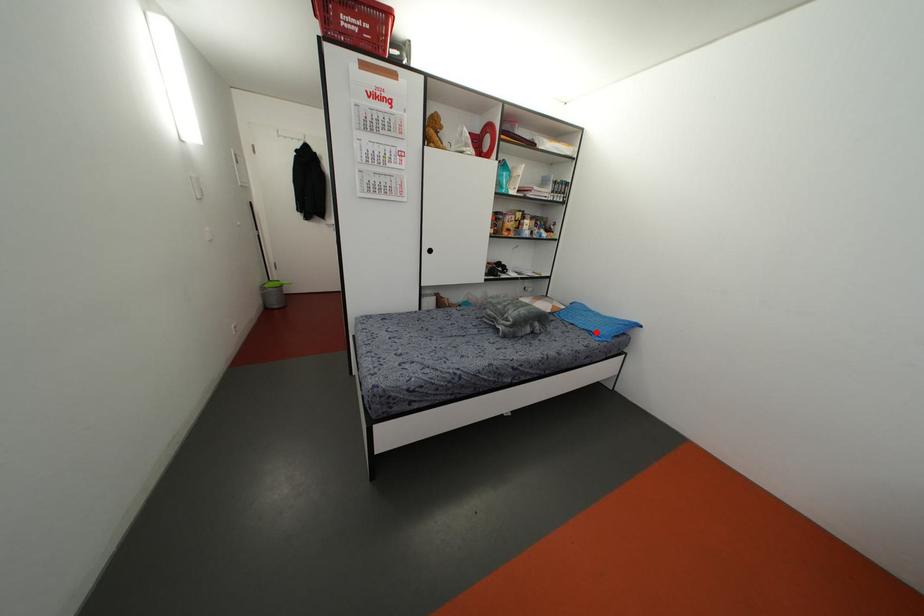
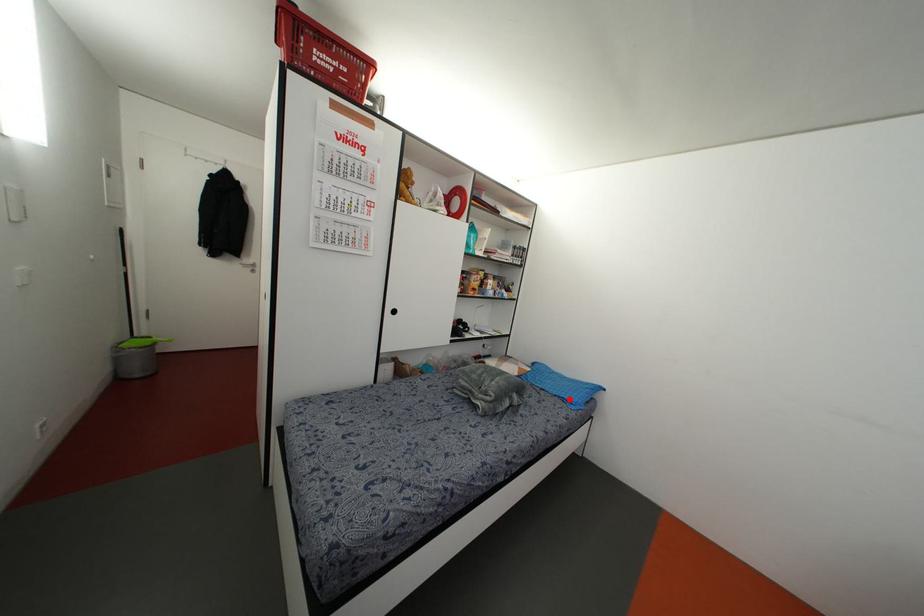
I am providing you with two images of the same scene from different viewpoints. A red point is marked on the first image and another point is marked on the second image. Do the highlighted points in image1 and image2 indicate the same real-world spot?

Yes